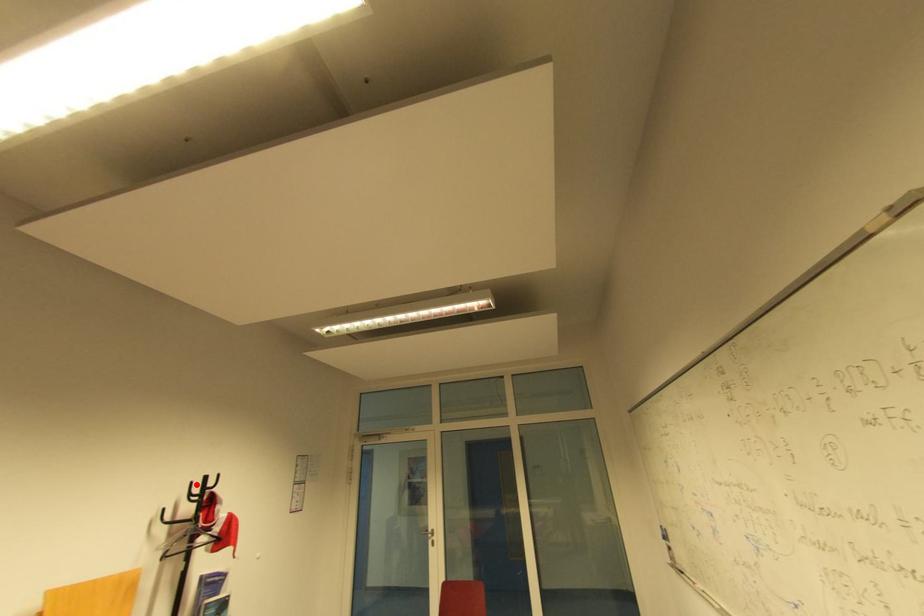
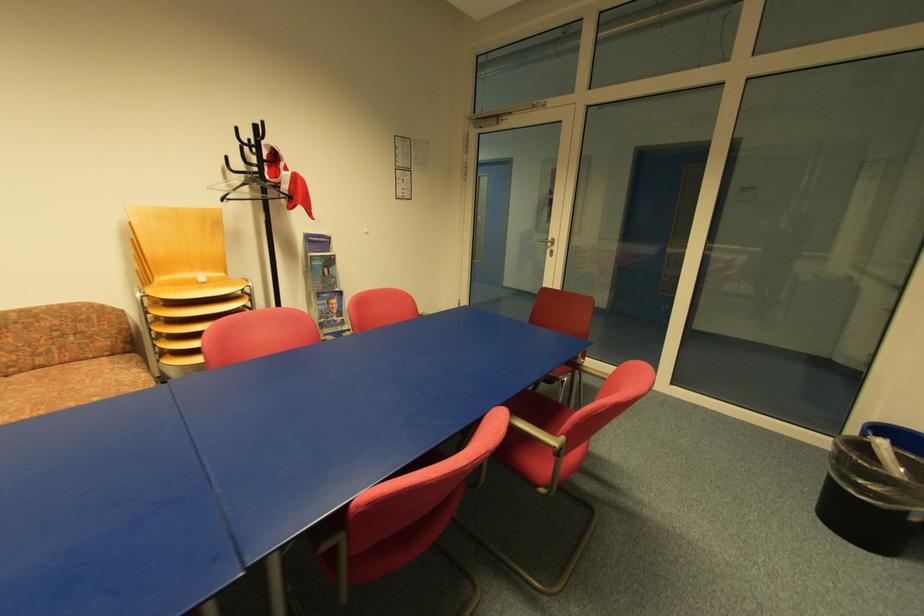
Find the pixel in the second image that matches the highlighted location in the first image.

(239, 130)